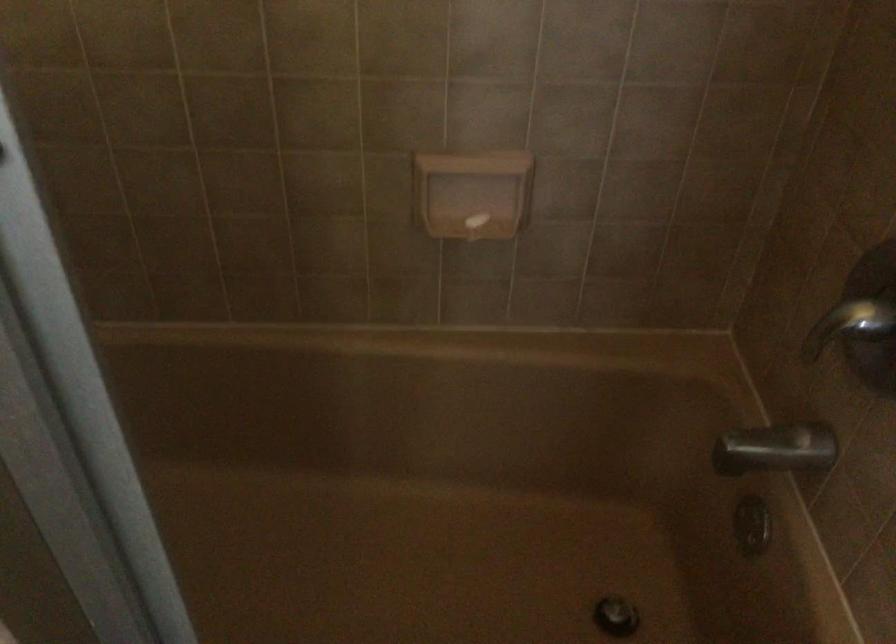
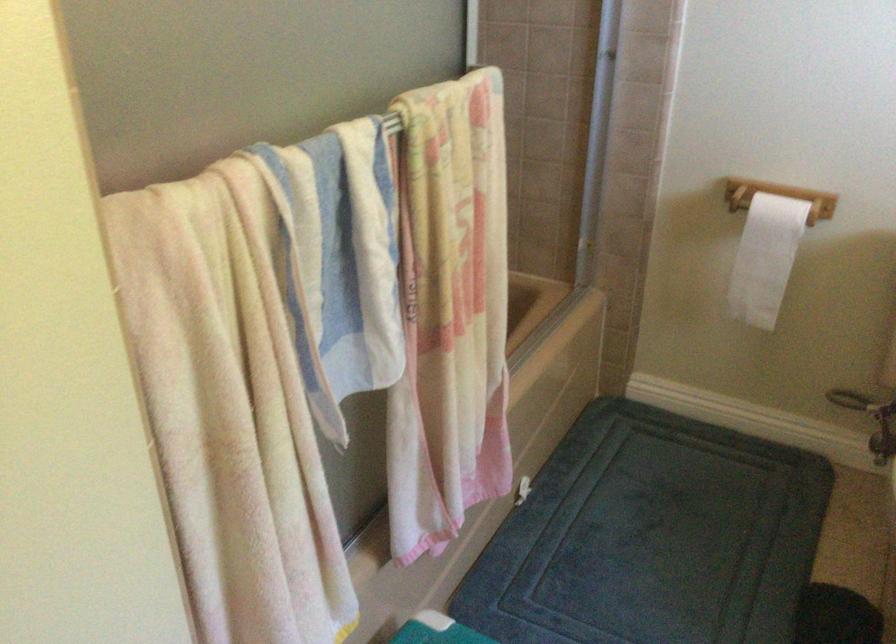
Question: I am providing you with two images of the same scene from different viewpoints. After the viewpoint changes to image2, which objects are now occluded?

Choices:
 (A) silver faucet lever
 (B) black office chair seat
 (C) white toilet paper
 (D) metal shower handle

Answer: (A)